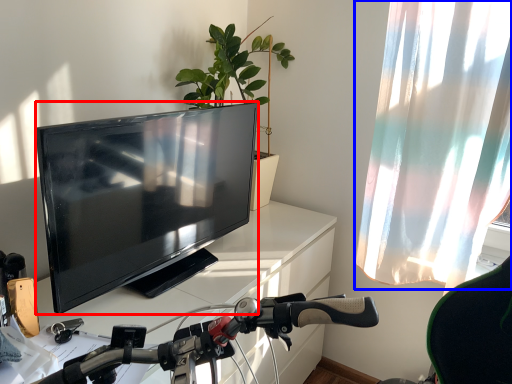
Question: Which object is further to the camera taking this photo, television (highlighted by a red box) or curtain (highlighted by a blue box)?

Choices:
 (A) television
 (B) curtain

Answer: (B)